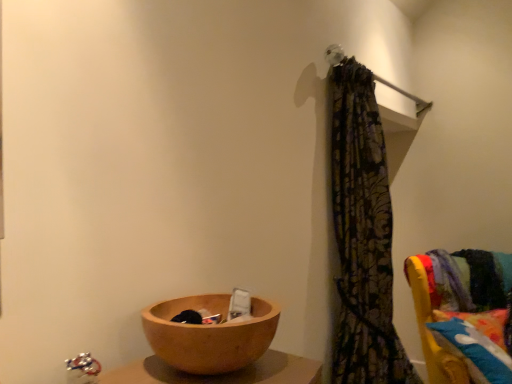
You are a GUI agent. You are given a task and a screenshot of the screen. Output one action in this format:
    pyautogui.click(x=<x>, y=<y>)
    Task: Click on the velvet yellow chair at right
    
    Given the screenshot: What is the action you would take?
    pyautogui.click(x=429, y=331)

Locate an element on the screen. The height and width of the screenshot is (384, 512). patterned fabric curtain at upper right is located at coordinates (362, 236).

Measure the distance between wooden bowl at lower left and camera.

wooden bowl at lower left is 34.28 inches from camera.

Locate an element on the screen. The width and height of the screenshot is (512, 384). velvet yellow chair at right is located at coordinates (429, 331).

Which is in front, wooden bowl at lower left or fluffy multicolored pillow at right?

wooden bowl at lower left.

Can you confirm if wooden bowl at lower left is positioned to the left of fluffy multicolored pillow at right?

Correct, you'll find wooden bowl at lower left to the left of fluffy multicolored pillow at right.

Is wooden bowl at lower left not near fluffy multicolored pillow at right?

wooden bowl at lower left is far away from fluffy multicolored pillow at right.

How different are the orientations of wooden bowl at lower left and fluffy multicolored pillow at right in degrees?

There is a 54.5-degree angle between the facing directions of wooden bowl at lower left and fluffy multicolored pillow at right.

Is fluffy multicolored pillow at right to the right of wooden bowl at lower left from the viewer's perspective?

Yes.

Considering the relative positions of fluffy multicolored pillow at right and wooden bowl at lower left in the image provided, is fluffy multicolored pillow at right in front of wooden bowl at lower left?

No, it is behind wooden bowl at lower left.

Considering the positions of points (495, 374) and (204, 301), is point (495, 374) farther from camera compared to point (204, 301)?

Yes, point (495, 374) is behind point (204, 301).

In the scene shown: Is fluffy multicolored pillow at right next to wooden bowl at lower left?

fluffy multicolored pillow at right and wooden bowl at lower left are not in contact.

Considering the positions of objects fluffy multicolored pillow at right and velvet yellow chair at right in the image provided, who is in front, fluffy multicolored pillow at right or velvet yellow chair at right?

velvet yellow chair at right.

Consider the image. Is fluffy multicolored pillow at right bigger than velvet yellow chair at right?

No, fluffy multicolored pillow at right is not bigger than velvet yellow chair at right.

From a real-world perspective, is fluffy multicolored pillow at right located higher than velvet yellow chair at right?

Yes, from a real-world perspective, fluffy multicolored pillow at right is on top of velvet yellow chair at right.

Are fluffy multicolored pillow at right and velvet yellow chair at right far apart?

No, fluffy multicolored pillow at right is not far from velvet yellow chair at right.

From the image's perspective, which is below, patterned fabric curtain at upper right or wooden bowl at lower left?

wooden bowl at lower left, from the image's perspective.

Between patterned fabric curtain at upper right and wooden bowl at lower left, which one has larger width?

patterned fabric curtain at upper right is wider.

Who is more distant, patterned fabric curtain at upper right or wooden bowl at lower left?

patterned fabric curtain at upper right is further away from the camera.

How many degrees apart are the facing directions of patterned fabric curtain at upper right and wooden bowl at lower left?

The angular difference between patterned fabric curtain at upper right and wooden bowl at lower left is 1.18 degrees.

Which object is positioned more to the left, patterned fabric curtain at upper right or velvet yellow chair at right?

From the viewer's perspective, patterned fabric curtain at upper right appears more on the left side.

Considering the sizes of objects patterned fabric curtain at upper right and velvet yellow chair at right in the image provided, who is smaller, patterned fabric curtain at upper right or velvet yellow chair at right?

With smaller size is patterned fabric curtain at upper right.

Does patterned fabric curtain at upper right lie in front of velvet yellow chair at right?

Yes, it is in front of velvet yellow chair at right.

Identify the location of curtain above the velvet yellow chair at right (from the image's perspective). This screenshot has width=512, height=384. (362, 236).

Measure the distance between fluffy multicolored pillow at right and patterned fabric curtain at upper right.

The distance of fluffy multicolored pillow at right from patterned fabric curtain at upper right is 18.64 inches.

From a real-world perspective, is fluffy multicolored pillow at right on patterned fabric curtain at upper right?

No.

Which object is positioned more to the left, fluffy multicolored pillow at right or patterned fabric curtain at upper right?

patterned fabric curtain at upper right.

Looking at the image, does fluffy multicolored pillow at right seem bigger or smaller compared to patterned fabric curtain at upper right?

Considering their sizes, fluffy multicolored pillow at right takes up less space than patterned fabric curtain at upper right.

Is velvet yellow chair at right far away from fluffy multicolored pillow at right?

That's not correct — velvet yellow chair at right is a little close to fluffy multicolored pillow at right.

Where is `pillow to the right of velvet yellow chair at right`? pillow to the right of velvet yellow chair at right is located at coordinates (473, 351).

Between point (425, 341) and point (490, 360), which one is positioned in front?

The point (490, 360) is in front.

Based on the photo, in the image, is velvet yellow chair at right positioned in front of or behind fluffy multicolored pillow at right?

velvet yellow chair at right is in front of fluffy multicolored pillow at right.

Identify the location of pillow lying below the wooden bowl at lower left (from the image's perspective). (473, 351).

The width and height of the screenshot is (512, 384). Find the location of `pillow behind the wooden bowl at lower left`. pillow behind the wooden bowl at lower left is located at coordinates (473, 351).

Considering their positions, is fluffy multicolored pillow at right positioned closer to patterned fabric curtain at upper right than wooden bowl at lower left?

fluffy multicolored pillow at right is closer to patterned fabric curtain at upper right.

Based on their spatial positions, is fluffy multicolored pillow at right or velvet yellow chair at right closer to patterned fabric curtain at upper right?

fluffy multicolored pillow at right is positioned closer to the anchor patterned fabric curtain at upper right.

Looking at the image, which one is located closer to fluffy multicolored pillow at right, velvet yellow chair at right or wooden bowl at lower left?

velvet yellow chair at right lies closer to fluffy multicolored pillow at right than the other object.

Looking at the image, which one is located further to fluffy multicolored pillow at right, velvet yellow chair at right or patterned fabric curtain at upper right?

Among the two, patterned fabric curtain at upper right is located further to fluffy multicolored pillow at right.

In the scene shown: Considering their positions, is wooden bowl at lower left positioned closer to fluffy multicolored pillow at right than velvet yellow chair at right?

Based on the image, velvet yellow chair at right appears to be nearer to fluffy multicolored pillow at right.

When comparing their distances from velvet yellow chair at right, does fluffy multicolored pillow at right or wooden bowl at lower left seem further?

Among the two, wooden bowl at lower left is located further to velvet yellow chair at right.

Considering their positions, is wooden bowl at lower left positioned closer to velvet yellow chair at right than patterned fabric curtain at upper right?

patterned fabric curtain at upper right lies closer to velvet yellow chair at right than the other object.

Looking at this image, from the image, which object appears to be farther from wooden bowl at lower left, velvet yellow chair at right or fluffy multicolored pillow at right?

Based on the image, velvet yellow chair at right appears to be further to wooden bowl at lower left.

In order to click on curtain between wooden bowl at lower left and velvet yellow chair at right from left to right in this screenshot , I will do `click(362, 236)`.

I want to click on furniture between wooden bowl at lower left and fluffy multicolored pillow at right in the horizontal direction, so click(429, 331).

Locate an element on the screen. This screenshot has width=512, height=384. curtain between wooden bowl at lower left and fluffy multicolored pillow at right is located at coordinates (362, 236).

Identify the location of furniture between patterned fabric curtain at upper right and fluffy multicolored pillow at right from left to right. The image size is (512, 384). (429, 331).